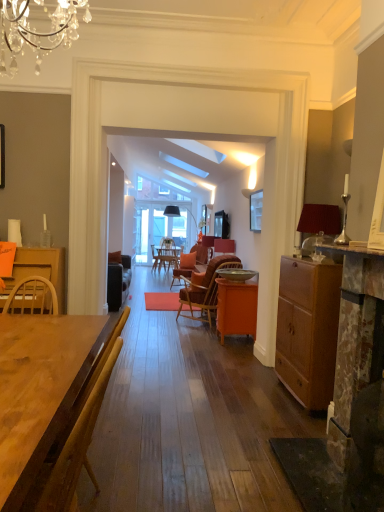
Question: Does point (226, 289) appear closer or farther from the camera than point (233, 242)?

Choices:
 (A) farther
 (B) closer

Answer: (B)

Question: Would you say orange matte cabinet at center, which appears as the first desk when viewed from the back, is to the left or to the right of matte black speaker at center in the picture?

Choices:
 (A) right
 (B) left

Answer: (A)

Question: Estimate the real-world distances between objects in this image. Which object is farther from the matte black picture frame at upper center?

Choices:
 (A) orange matte cabinet at center, which ranks as the 2th desk in front-to-back order
 (B) matte black speaker at center
 (C) wooden table at center, positioned as the 1th desk in front-to-back order
 (D) brown woven chair at center
 (E) matte brown cabinet at right

Answer: (C)

Question: Estimate the real-world distances between objects in this image. Which object is closer to the brown woven chair at center?

Choices:
 (A) matte brown cabinet at right
 (B) wooden table at center, arranged as the 2th desk when viewed from the right
 (C) matte black speaker at center
 (D) matte black picture frame at upper center
 (E) matte red lampshade at right

Answer: (C)